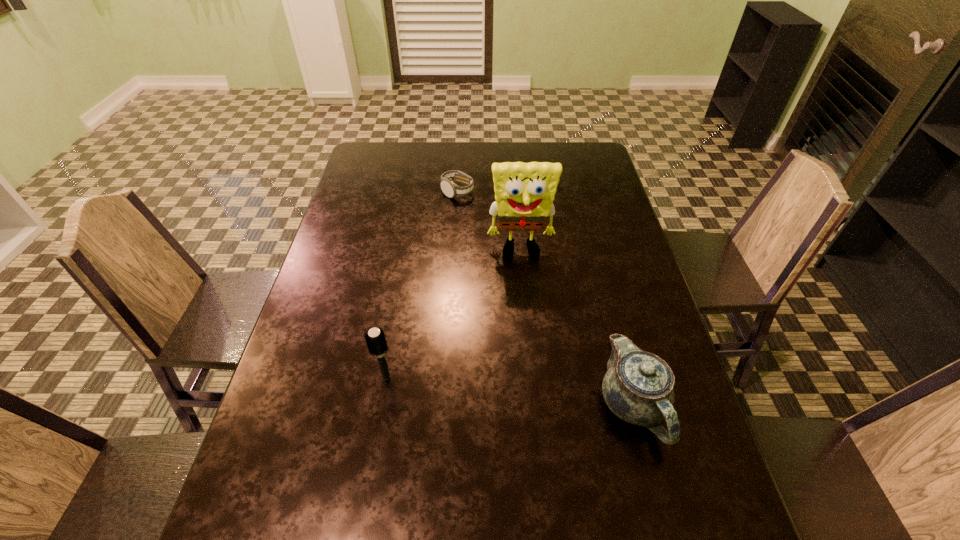
Find the location of a particular element. The image size is (960, 540). hairbrush is located at coordinates (375, 338).

Locate an element on the screen. the rightmost object is located at coordinates pos(638,387).

Find the location of a particular element. chinaware is located at coordinates (638, 387).

At what (x,y) coordinates should I click in order to perform the action: click on watch. Please return your answer as a coordinate pair (x, y). This screenshot has height=540, width=960. Looking at the image, I should click on (449, 188).

Where is `the farthest object`? the farthest object is located at coordinates (449, 188).

Where is `sponge`? sponge is located at coordinates (524, 192).

Image resolution: width=960 pixels, height=540 pixels. What are the coordinates of `the tallest object` in the screenshot? It's located at (524, 192).

This screenshot has width=960, height=540. In order to click on free spot located 0.330m on the right of the hairbrush in this screenshot , I will do `click(540, 377)`.

Image resolution: width=960 pixels, height=540 pixels. Identify the location of vacant space located from the spout of the rightmost object. (656, 493).

This screenshot has width=960, height=540. Identify the location of free space located on the face of the third object from right to left. (463, 214).